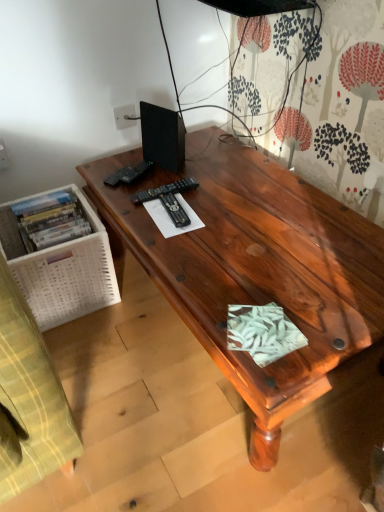
The width and height of the screenshot is (384, 512). Identify the location of vacant area that is situated to the right of black matte speaker at upper left. (215, 161).